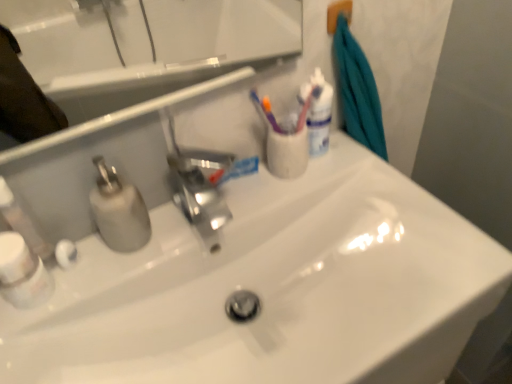
Locate an element on the screen. empty space that is to the right of white glossy mouthwash at upper right, which appears as the 2th mouthwash when viewed from the front is located at coordinates [362, 162].